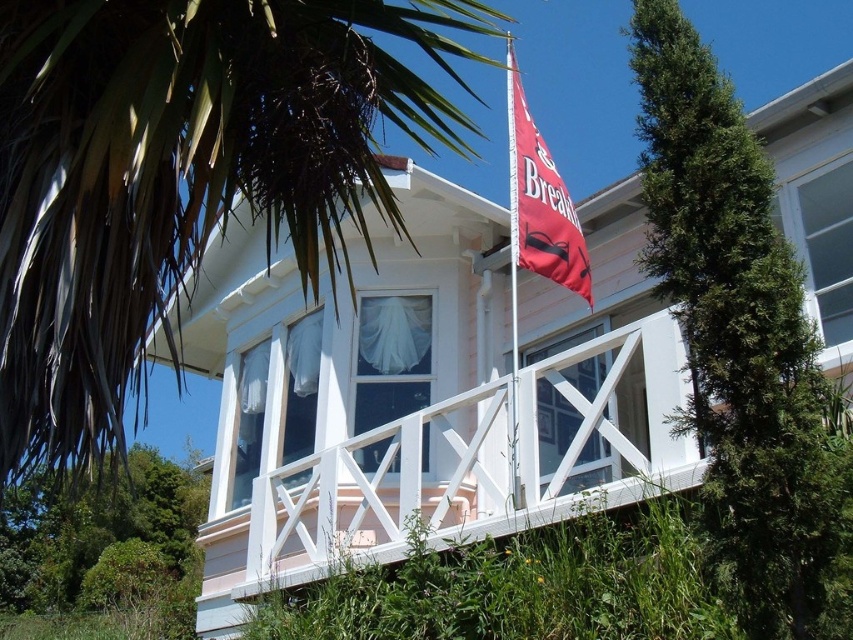
Question: Which of the following is the farthest from the observer?

Choices:
 (A) red fabric flag at upper center
 (B) metallic flag pole at center

Answer: (B)

Question: Can you confirm if red fabric flag at upper center is thinner than metallic flag pole at center?

Choices:
 (A) yes
 (B) no

Answer: (B)

Question: Which point is farther to the camera?

Choices:
 (A) (70, 433)
 (B) (511, 433)
 (C) (521, 189)

Answer: (C)

Question: Is red fabric flag at upper center further to camera compared to metallic flag pole at center?

Choices:
 (A) yes
 (B) no

Answer: (B)

Question: Which point appears farthest from the camera in this image?

Choices:
 (A) (534, 252)
 (B) (512, 180)
 (C) (252, 145)

Answer: (B)

Question: Does green leafy palm tree at upper left have a smaller size compared to red fabric flag at upper center?

Choices:
 (A) yes
 (B) no

Answer: (B)